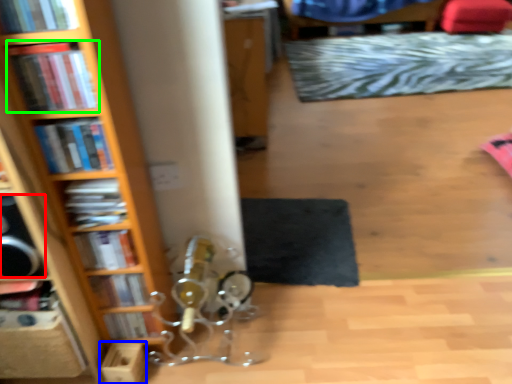
Question: Which object is positioned farthest from speaker (highlighted by a red box)? Select from cardboard box (highlighted by a blue box) and book (highlighted by a green box).

Choices:
 (A) cardboard box
 (B) book

Answer: (A)